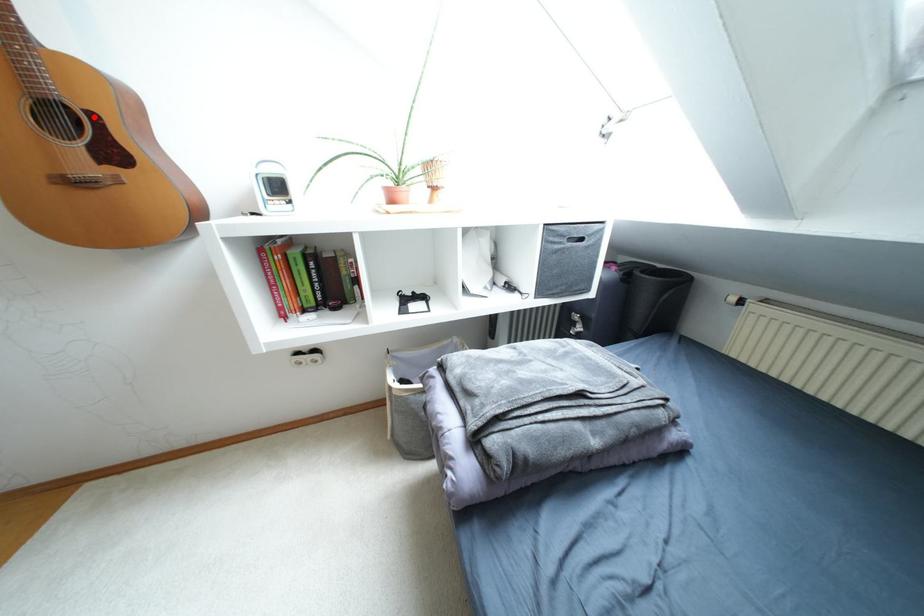
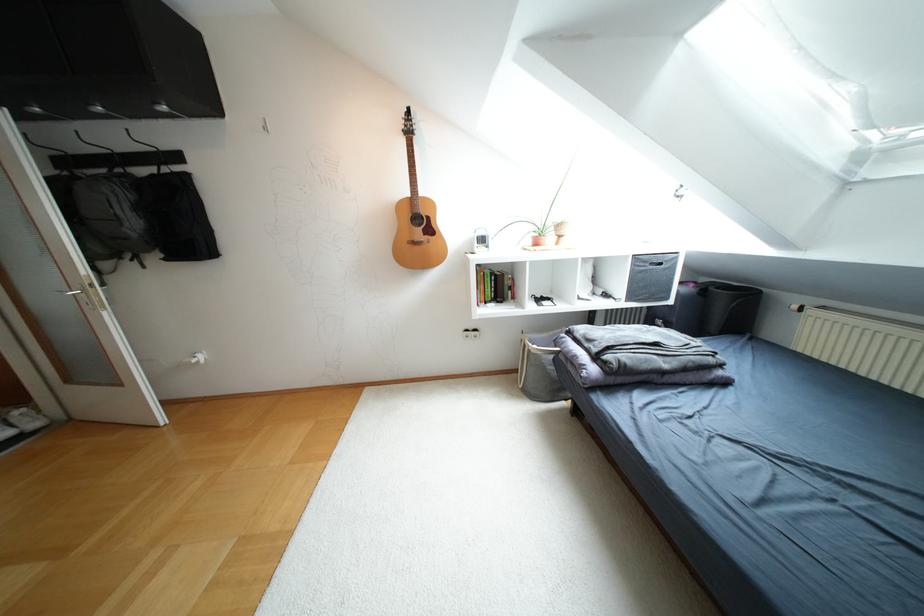
Question: I am providing you with two images of the same scene from different viewpoints. Given a red point in image1, look at the same physical point in image2. Is it:

Choices:
 (A) Closer to the viewpoint
 (B) Farther from the viewpoint

Answer: (A)